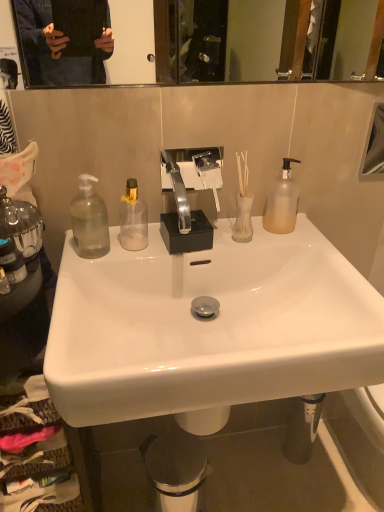
Question: Can you confirm if metallic trash can at lower center is thinner than frosted glass pump bottle at right, the first bottle from the right?

Choices:
 (A) no
 (B) yes

Answer: (A)

Question: Is metallic trash can at lower center positioned beyond the bounds of frosted glass pump bottle at right, the fifth bottle from the left?

Choices:
 (A) no
 (B) yes

Answer: (B)

Question: Considering the relative positions of metallic trash can at lower center and frosted glass pump bottle at right, the first bottle from the right, in the image provided, is metallic trash can at lower center to the left of frosted glass pump bottle at right, the first bottle from the right, from the viewer's perspective?

Choices:
 (A) yes
 (B) no

Answer: (A)

Question: Is metallic trash can at lower center to the right of frosted glass pump bottle at right, the first bottle from the right, from the viewer's perspective?

Choices:
 (A) no
 (B) yes

Answer: (A)

Question: Is metallic trash can at lower center positioned far away from frosted glass pump bottle at right, the fifth bottle from the left?

Choices:
 (A) no
 (B) yes

Answer: (A)

Question: Considering the positions of point (168, 450) and point (382, 125), is point (168, 450) closer or farther from the camera than point (382, 125)?

Choices:
 (A) farther
 (B) closer

Answer: (A)

Question: Relative to glossy glass mirror at upper right, is metallic trash can at lower center in front or behind?

Choices:
 (A) front
 (B) behind

Answer: (B)

Question: From the image's perspective, is metallic trash can at lower center positioned above or below glossy glass mirror at upper right?

Choices:
 (A) above
 (B) below

Answer: (B)

Question: In terms of size, does metallic trash can at lower center appear bigger or smaller than glossy glass mirror at upper right?

Choices:
 (A) big
 (B) small

Answer: (A)

Question: Is clear glass soap dispenser at left, positioned as the 4th bottle in right-to-left order, bigger or smaller than clear glass soap dispenser at left, acting as the 5th bottle starting from the right?

Choices:
 (A) big
 (B) small

Answer: (B)

Question: Is point (4, 276) positioned closer to the camera than point (16, 276)?

Choices:
 (A) farther
 (B) closer

Answer: (B)

Question: Considering the relative positions of clear glass soap dispenser at left, positioned as the 4th bottle in right-to-left order, and clear glass soap dispenser at left, acting as the 5th bottle starting from the right, in the image provided, is clear glass soap dispenser at left, positioned as the 4th bottle in right-to-left order, to the left or to the right of clear glass soap dispenser at left, acting as the 5th bottle starting from the right,?

Choices:
 (A) right
 (B) left

Answer: (A)

Question: Is clear glass soap dispenser at left, positioned as the 4th bottle in right-to-left order, taller or shorter than clear glass soap dispenser at left, acting as the 5th bottle starting from the right?

Choices:
 (A) short
 (B) tall

Answer: (A)

Question: Considering the positions of white glossy sink at center and clear glass soap dispenser at left, acting as the 5th bottle starting from the right, in the image, is white glossy sink at center wider or thinner than clear glass soap dispenser at left, acting as the 5th bottle starting from the right,?

Choices:
 (A) wide
 (B) thin

Answer: (A)

Question: Is white glossy sink at center situated inside clear glass soap dispenser at left, the first bottle when ordered from left to right, or outside?

Choices:
 (A) inside
 (B) outside

Answer: (B)